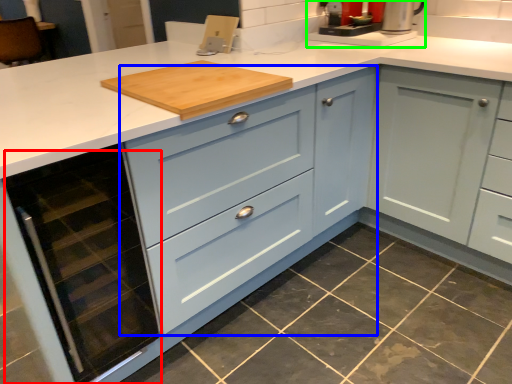
Question: Considering the real-world distances, which object is closest to oven (highlighted by a red box)? cabinetry (highlighted by a blue box) or coffee machine (highlighted by a green box).

Choices:
 (A) cabinetry
 (B) coffee machine

Answer: (A)